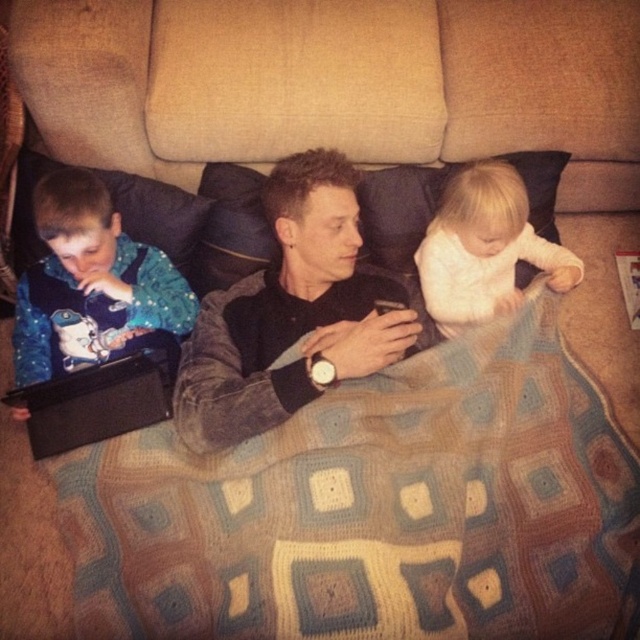
Question: Among these points, which one is farthest from the camera?

Choices:
 (A) (196, 387)
 (B) (76, 566)

Answer: (B)

Question: Which object is closer to the camera taking this photo?

Choices:
 (A) blue fabric baby at left
 (B) white soft fabric at center
 (C) knitted wool blanket at center

Answer: (C)

Question: Does blue fabric baby at left have a lesser width compared to white soft fabric at center?

Choices:
 (A) yes
 (B) no

Answer: (B)

Question: Does knitted wool blanket at center appear under blue fabric baby at left?

Choices:
 (A) no
 (B) yes

Answer: (B)

Question: Does blue fabric baby at left appear under white soft fabric at center?

Choices:
 (A) no
 (B) yes

Answer: (B)

Question: Which object is the farthest from the white soft fabric at center?

Choices:
 (A) suede black jacket at center
 (B) blue fabric baby at left

Answer: (B)